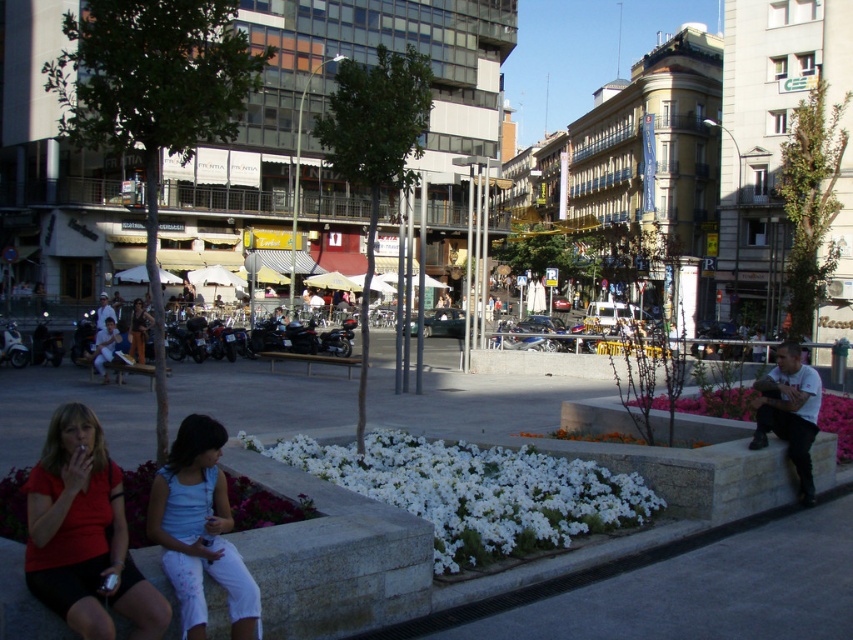
Question: Is white cotton shirt at lower right wider than shiny black motorcycle at center?

Choices:
 (A) no
 (B) yes

Answer: (A)

Question: Is pink fabric flower at lower right positioned in front of shiny black motorcycle at center?

Choices:
 (A) no
 (B) yes

Answer: (B)

Question: Which is nearer to the matte red shirt at lower left?

Choices:
 (A) light blue denim jeans at center
 (B) pink fabric flower at lower right

Answer: (B)

Question: Considering the real-world distances, which object is farthest from the light blue denim shorts at center?

Choices:
 (A) pink fabric flower at lower right
 (B) light blue denim jeans at center

Answer: (A)

Question: Which object is the farthest from the matte red shirt at lower left?

Choices:
 (A) shiny black motorcycle at center
 (B) white stone flower bed at center

Answer: (A)

Question: Is white stone flower bed at center smaller than white cotton shirt at lower right?

Choices:
 (A) yes
 (B) no

Answer: (B)